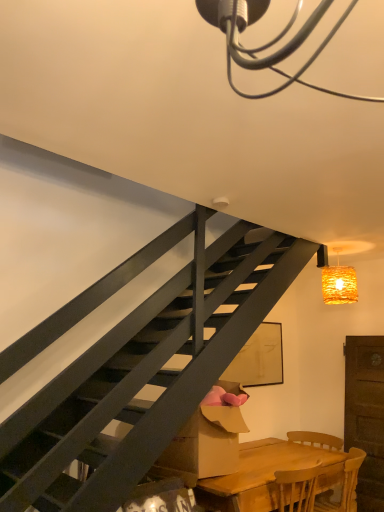
Question: Is cardboard box at lower center behind woven wicker lampshade at upper right?

Choices:
 (A) no
 (B) yes

Answer: (A)

Question: From a real-world perspective, is cardboard box at lower center physically below woven wicker lampshade at upper right?

Choices:
 (A) yes
 (B) no

Answer: (A)

Question: Could you tell me if cardboard box at lower center is facing woven wicker lampshade at upper right?

Choices:
 (A) yes
 (B) no

Answer: (B)

Question: Considering the relative sizes of cardboard box at lower center and woven wicker lampshade at upper right in the image provided, is cardboard box at lower center shorter than woven wicker lampshade at upper right?

Choices:
 (A) yes
 (B) no

Answer: (B)

Question: Is cardboard box at lower center not inside woven wicker lampshade at upper right?

Choices:
 (A) yes
 (B) no

Answer: (A)

Question: Can you confirm if cardboard box at lower center is positioned to the right of woven wicker lampshade at upper right?

Choices:
 (A) yes
 (B) no

Answer: (B)

Question: Does woven wicker lampshade at upper right have a larger size compared to wooden table at lower right?

Choices:
 (A) yes
 (B) no

Answer: (B)

Question: Considering the relative sizes of woven wicker lampshade at upper right and wooden table at lower right in the image provided, is woven wicker lampshade at upper right thinner than wooden table at lower right?

Choices:
 (A) yes
 (B) no

Answer: (A)

Question: From the image's perspective, is woven wicker lampshade at upper right beneath wooden table at lower right?

Choices:
 (A) yes
 (B) no

Answer: (B)

Question: From the image's perspective, is woven wicker lampshade at upper right located above wooden table at lower right?

Choices:
 (A) no
 (B) yes

Answer: (B)

Question: Is woven wicker lampshade at upper right closer to the viewer compared to wooden table at lower right?

Choices:
 (A) no
 (B) yes

Answer: (A)

Question: Considering the relative positions of woven wicker lampshade at upper right and wooden table at lower right in the image provided, is woven wicker lampshade at upper right to the right of wooden table at lower right from the viewer's perspective?

Choices:
 (A) no
 (B) yes

Answer: (B)

Question: Is wooden chair at lower right taller than wooden table at lower right?

Choices:
 (A) no
 (B) yes

Answer: (A)